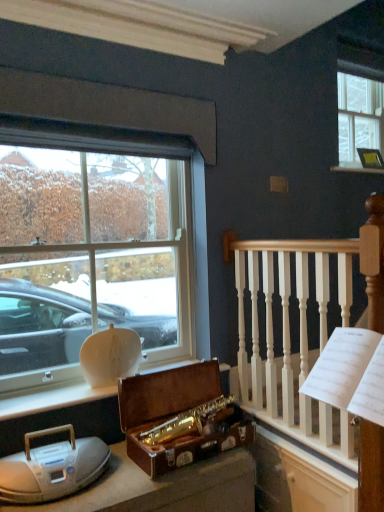
Question: From a real-world perspective, is clear glass window at upper right, which appears as the first window when viewed from the back, beneath wooden suitcase at center?

Choices:
 (A) yes
 (B) no

Answer: (B)

Question: Is clear glass window at upper right, which is the 1th window from right to left, wider than wooden suitcase at center?

Choices:
 (A) no
 (B) yes

Answer: (A)

Question: Could you tell me if clear glass window at upper right, the second window from the front, is turned towards wooden suitcase at center?

Choices:
 (A) no
 (B) yes

Answer: (A)

Question: Can you confirm if clear glass window at upper right, the second window from the front, is taller than wooden suitcase at center?

Choices:
 (A) no
 (B) yes

Answer: (B)

Question: From the image's perspective, is clear glass window at upper right, which is the 2th window from bottom to top, beneath wooden suitcase at center?

Choices:
 (A) no
 (B) yes

Answer: (A)

Question: Is clear glass window at upper right, which is the 2th window from bottom to top, far from wooden suitcase at center?

Choices:
 (A) no
 (B) yes

Answer: (B)

Question: Is white wood railing at upper right to the left of metallic gold picture frame at upper right from the viewer's perspective?

Choices:
 (A) yes
 (B) no

Answer: (A)

Question: Does white wood railing at upper right appear on the right side of metallic gold picture frame at upper right?

Choices:
 (A) yes
 (B) no

Answer: (B)

Question: Is white wood railing at upper right further to camera compared to metallic gold picture frame at upper right?

Choices:
 (A) no
 (B) yes

Answer: (A)

Question: From the image's perspective, is white wood railing at upper right located beneath metallic gold picture frame at upper right?

Choices:
 (A) no
 (B) yes

Answer: (B)

Question: Is white wood railing at upper right next to metallic gold picture frame at upper right and touching it?

Choices:
 (A) yes
 (B) no

Answer: (B)

Question: Is white wood railing at upper right positioned with its back to metallic gold picture frame at upper right?

Choices:
 (A) no
 (B) yes

Answer: (A)

Question: Considering the relative sizes of metallic gold picture frame at upper right and white wood railing at upper right in the image provided, is metallic gold picture frame at upper right wider than white wood railing at upper right?

Choices:
 (A) no
 (B) yes

Answer: (A)